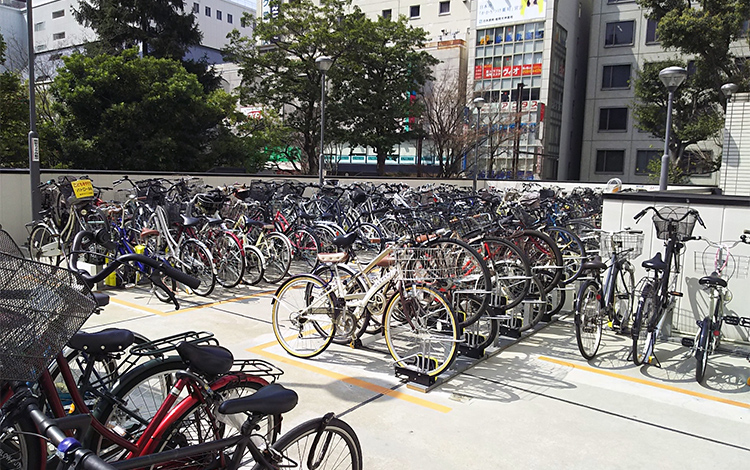
This screenshot has height=470, width=750. In order to click on light in this screenshot , I will do `click(670, 75)`, `click(727, 88)`, `click(476, 97)`, `click(325, 58)`.